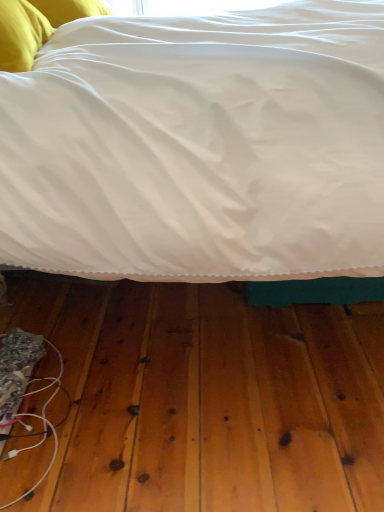
Question: Does white satin bed at center turn towards yellow fabric pillow at upper left?

Choices:
 (A) no
 (B) yes

Answer: (A)

Question: Is yellow fabric pillow at upper left inside white satin bed at center?

Choices:
 (A) yes
 (B) no

Answer: (A)

Question: From a real-world perspective, is white satin bed at center over yellow fabric pillow at upper left?

Choices:
 (A) no
 (B) yes

Answer: (A)

Question: From the image's perspective, is white satin bed at center on top of yellow fabric pillow at upper left?

Choices:
 (A) yes
 (B) no

Answer: (B)

Question: Can you confirm if white satin bed at center is bigger than yellow fabric pillow at upper left?

Choices:
 (A) yes
 (B) no

Answer: (A)

Question: From the image's perspective, is white satin bed at center located above or below yellow fabric pillow at upper left?

Choices:
 (A) above
 (B) below

Answer: (B)

Question: Is point (3, 139) positioned closer to the camera than point (61, 19)?

Choices:
 (A) closer
 (B) farther

Answer: (A)

Question: Considering the positions of white satin bed at center and yellow fabric pillow at upper left in the image, is white satin bed at center taller or shorter than yellow fabric pillow at upper left?

Choices:
 (A) short
 (B) tall

Answer: (B)

Question: In terms of size, does white satin bed at center appear bigger or smaller than yellow fabric pillow at upper left?

Choices:
 (A) big
 (B) small

Answer: (A)

Question: From the image's perspective, is white satin bed at center above or below white fabric wire at lower left?

Choices:
 (A) below
 (B) above

Answer: (B)

Question: Relative to white fabric wire at lower left, is white satin bed at center in front or behind?

Choices:
 (A) front
 (B) behind

Answer: (A)

Question: In terms of size, does white satin bed at center appear bigger or smaller than white fabric wire at lower left?

Choices:
 (A) small
 (B) big

Answer: (B)

Question: Visually, is white satin bed at center positioned to the left or to the right of white fabric wire at lower left?

Choices:
 (A) right
 (B) left

Answer: (A)

Question: From the image's perspective, is white fabric wire at lower left located above or below white satin bed at center?

Choices:
 (A) above
 (B) below

Answer: (B)

Question: Do you think white fabric wire at lower left is within white satin bed at center, or outside of it?

Choices:
 (A) outside
 (B) inside

Answer: (B)